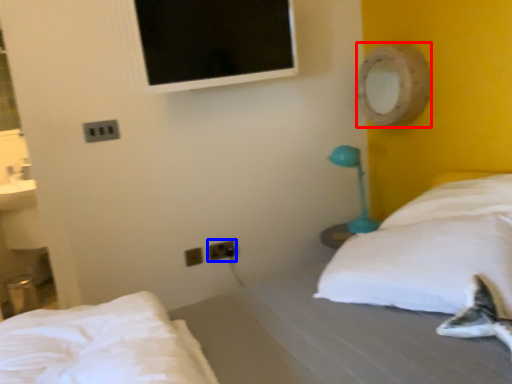
Question: Which object appears farthest to the camera in this image, mirror (highlighted by a red box) or electric outlet (highlighted by a blue box)?

Choices:
 (A) mirror
 (B) electric outlet

Answer: (B)